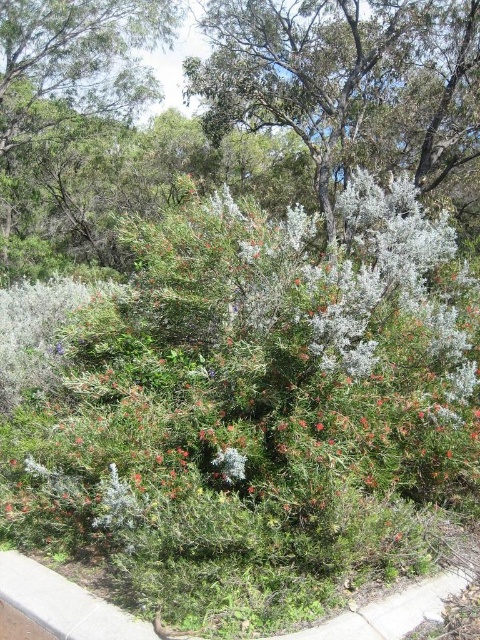
Question: Does green leafy bush at center have a smaller size compared to white fluffy bush at upper center?

Choices:
 (A) no
 (B) yes

Answer: (A)

Question: Which point appears farthest from the camera in this image?

Choices:
 (A) (25, 524)
 (B) (32, 262)
 (C) (253, 22)

Answer: (B)

Question: Which point is farther from the camera taking this photo?

Choices:
 (A) (358, 440)
 (B) (326, 180)
 (C) (97, 113)

Answer: (C)

Question: Does white fluffy bush at upper center appear under green leafy tree at upper left?

Choices:
 (A) no
 (B) yes

Answer: (A)

Question: Can you confirm if white fluffy bush at upper center is thinner than green leafy tree at upper left?

Choices:
 (A) no
 (B) yes

Answer: (B)

Question: Which object is closer to the camera taking this photo?

Choices:
 (A) white fluffy bush at upper center
 (B) green leafy bush at center
 (C) green leafy tree at upper left

Answer: (B)